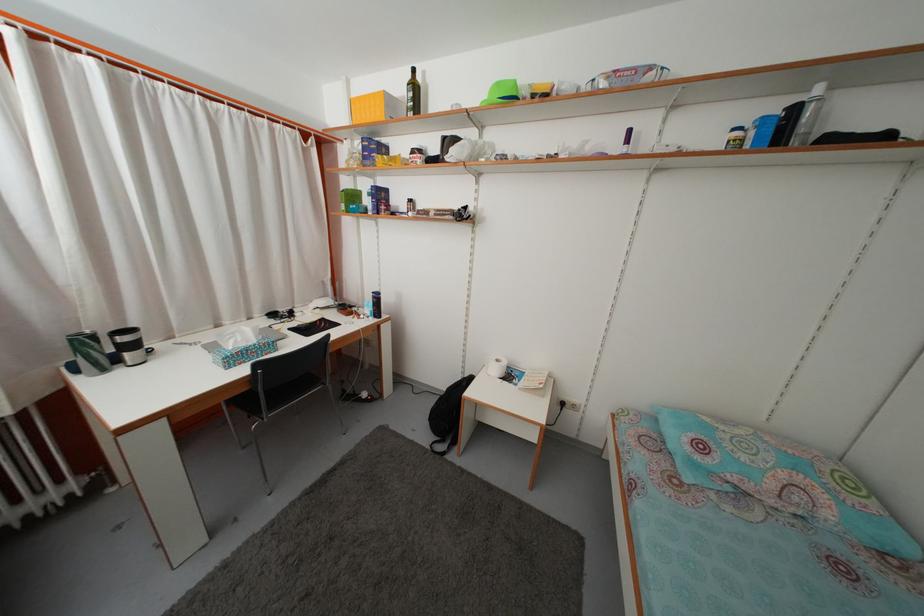
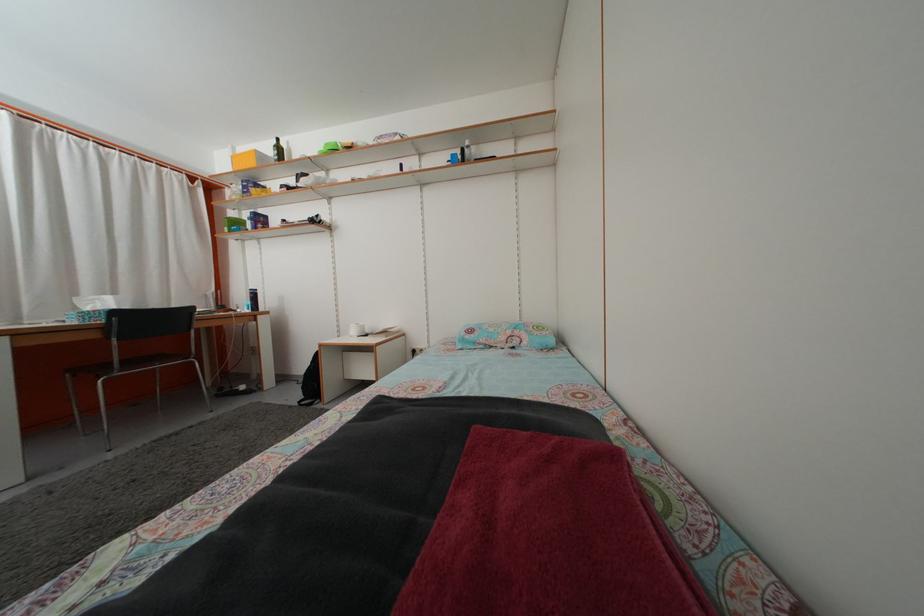
In the second image, find the point that corresponds to point 353,89 in the first image.

(239, 156)